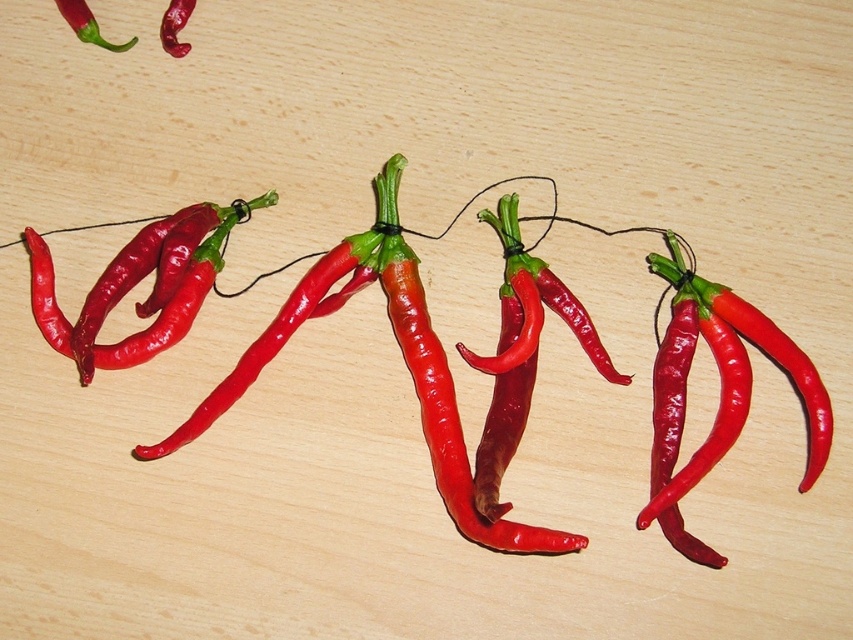
In the scene shown: Which of these two, matte red pepper at upper left or glossy red pepper at upper left, stands shorter?

matte red pepper at upper left

Between matte red pepper at upper left and glossy red pepper at upper left, which one is positioned higher?

glossy red pepper at upper left

Does point (84, 33) come farther from viewer compared to point (175, 3)?

No.

Image resolution: width=853 pixels, height=640 pixels. Identify the location of matte red pepper at upper left. (86, 24).